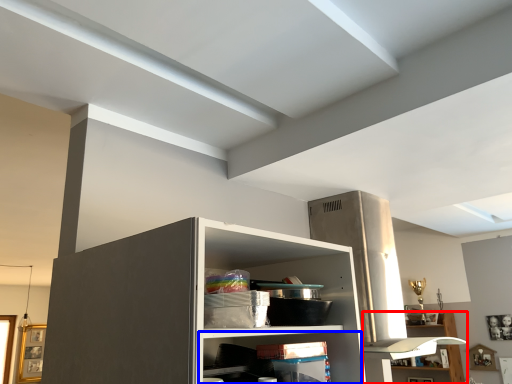
Question: Which point is further to the camera, shelf (highlighted by a red box) or shelf (highlighted by a blue box)?

Choices:
 (A) shelf
 (B) shelf

Answer: (A)